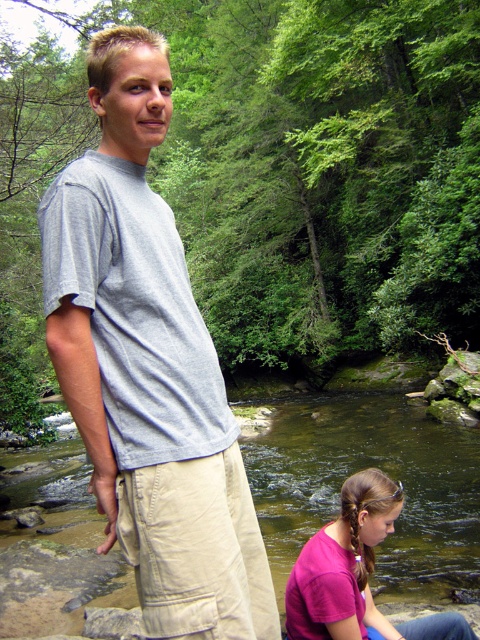
You are standing in the scene and want to know if the green smooth water at lower center is taller than the pink matte shirt at lower center. Can you confirm this?

The green smooth water at lower center has a greater height compared to the pink matte shirt at lower center, so yes, the green smooth water at lower center is taller than the pink matte shirt at lower center.